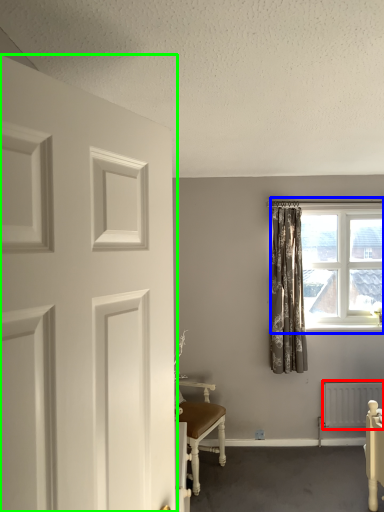
Question: Which is nearer to the radiator (highlighted by a red box)? window (highlighted by a blue box) or door (highlighted by a green box).

Choices:
 (A) window
 (B) door

Answer: (A)